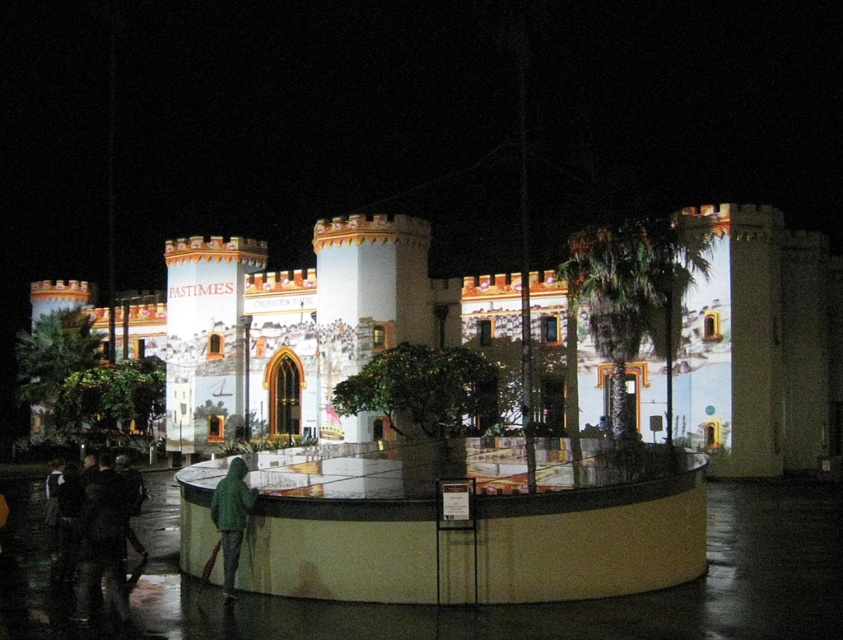
Question: Among these objects, which one is farthest from the camera?

Choices:
 (A) matte white castle at center
 (B) green matte jacket at lower left

Answer: (A)

Question: From the image, what is the correct spatial relationship of matte white castle at center in relation to green matte jacket at lower left?

Choices:
 (A) right
 (B) left

Answer: (B)

Question: Does matte white castle at center have a larger size compared to green matte jacket at lower left?

Choices:
 (A) no
 (B) yes

Answer: (B)

Question: Is matte white castle at center positioned behind green matte jacket at lower left?

Choices:
 (A) yes
 (B) no

Answer: (A)